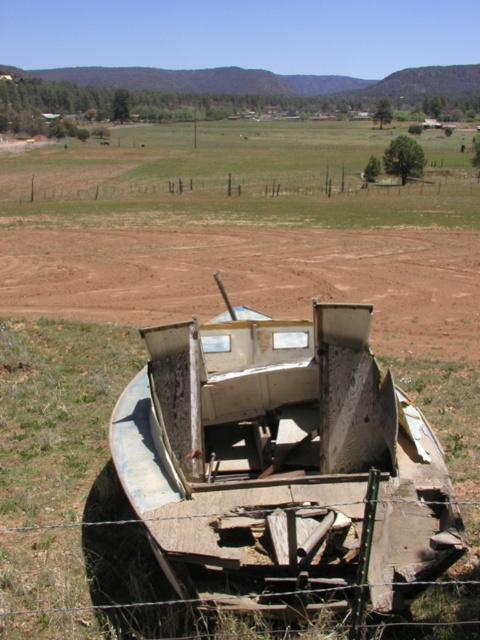
You are a painter standing at the edge of the field. You want to paint the rusty metal boat at center and the brown wooden fence at upper center. Which object will require you to look upward more to capture its full height?

The brown wooden fence at upper center is taller than the rusty metal boat at center, so you will need to look upward more to capture its full height.

You are standing at the origin point of the image coordinate system. Which direction should you move to reach the rusty metal boat at center?

The rusty metal boat at center is located at coordinates point (283, 465), so you should move towards the positive x and y directions to reach it.